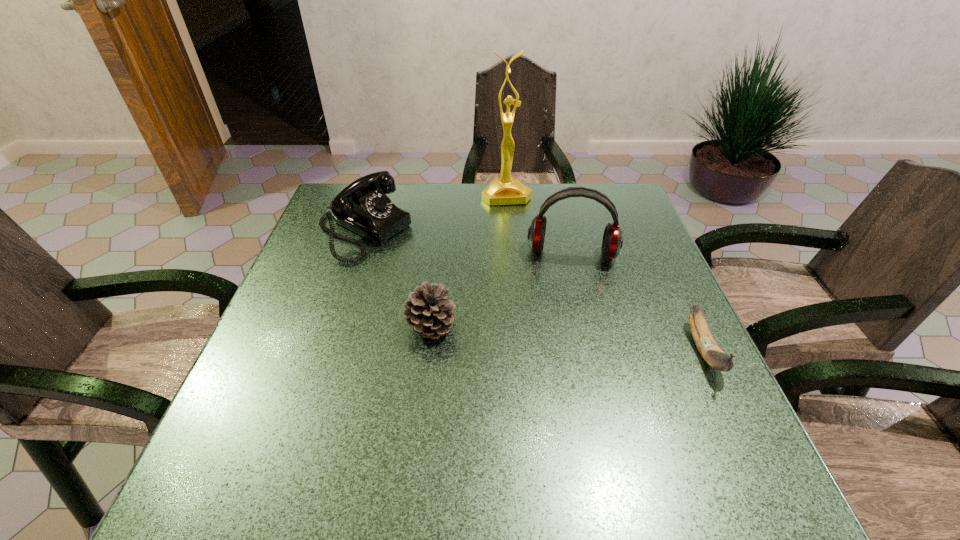
Find the location of a particular element. This screenshot has height=540, width=960. free location located 0.220m on the ear cups of the earphone is located at coordinates (562, 335).

Where is `vacant space located on the ear cups of the earphone`? This screenshot has height=540, width=960. vacant space located on the ear cups of the earphone is located at coordinates (561, 350).

The width and height of the screenshot is (960, 540). Identify the location of vacant space located 0.110m on the ear cups of the earphone. (564, 300).

Find the location of `blank space located 0.090m on the front-facing side of the award`. blank space located 0.090m on the front-facing side of the award is located at coordinates (516, 224).

Where is `vacant space located on the front-facing side of the award`? The height and width of the screenshot is (540, 960). vacant space located on the front-facing side of the award is located at coordinates (540, 300).

Identify the location of vacant space located 0.390m on the front-facing side of the award. (540, 297).

The height and width of the screenshot is (540, 960). What are the coordinates of `free location located 0.190m on the dial of the leftmost object` in the screenshot? It's located at (453, 280).

This screenshot has width=960, height=540. I want to click on vacant space located on the dial of the leftmost object, so (x=466, y=287).

This screenshot has width=960, height=540. I want to click on vacant area situated on the dial of the leftmost object, so click(x=500, y=305).

Locate an element on the screen. This screenshot has height=540, width=960. award that is at the far edge is located at coordinates (505, 190).